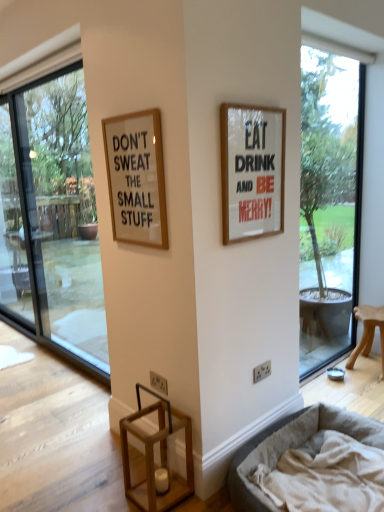
Question: Is transparent glass window at left, positioned as the first window in left-to-right order, to the left or to the right of gray fabric dog bed at lower right in the image?

Choices:
 (A) left
 (B) right

Answer: (A)

Question: In terms of width, does transparent glass window at left, which is the second window in right-to-left order, look wider or thinner when compared to gray fabric dog bed at lower right?

Choices:
 (A) wide
 (B) thin

Answer: (B)

Question: Considering the real-world distances, which object is farthest from the transparent glass window at right, arranged as the second window when viewed from the left?

Choices:
 (A) wooden stool at right
 (B) transparent glass screen door at left
 (C) gray fabric dog bed at lower right
 (D) transparent glass window at left, which is the second window in right-to-left order
 (E) white matte picture frame at upper right, the first picture frame in the right-to-left sequence

Answer: (B)

Question: Estimate the real-world distances between objects in this image. Which object is closer to the white matte picture frame at upper right, the first picture frame in the right-to-left sequence?

Choices:
 (A) transparent glass window at right, arranged as the second window when viewed from the left
 (B) transparent glass window at left, positioned as the first window in left-to-right order
 (C) wooden stool at right
 (D) transparent glass screen door at left
 (E) gray fabric dog bed at lower right

Answer: (E)